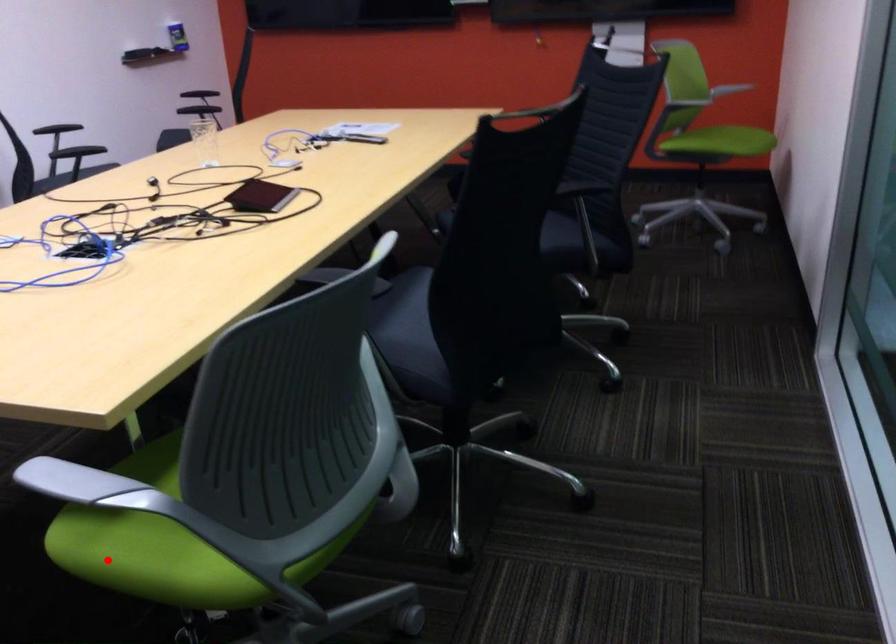
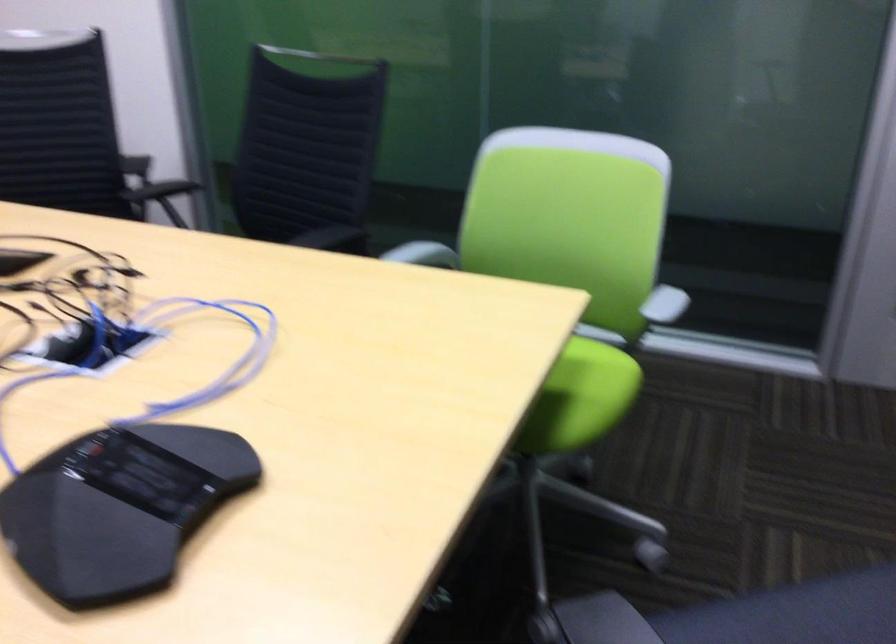
Question: I am providing you with two images of the same scene from different viewpoints. Given a red point in image1, look at the same physical point in image2. Is it:

Choices:
 (A) Closer to the viewpoint
 (B) Farther from the viewpoint

Answer: (B)